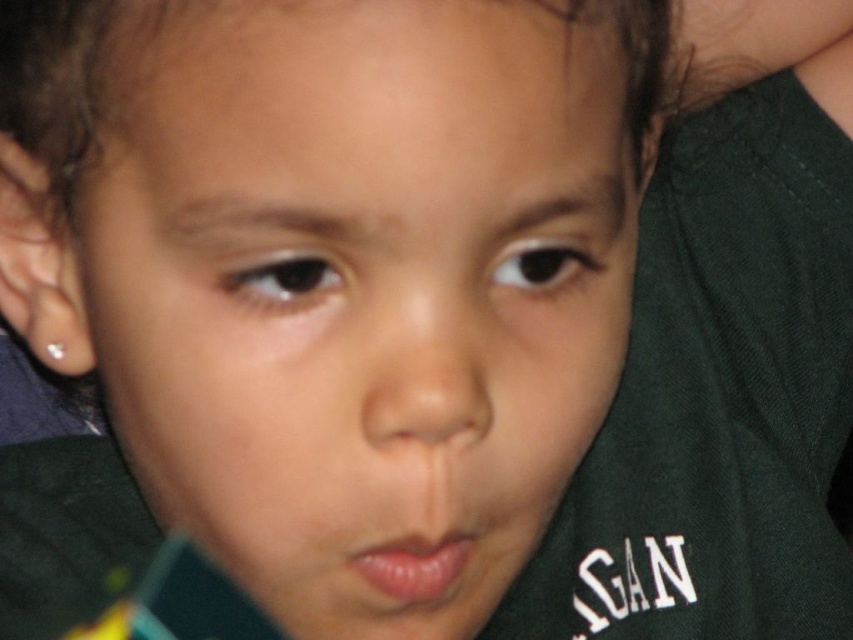
In the scene shown: Is smooth skin face at center to the left of smooth skin nose at center from the viewer's perspective?

Yes, smooth skin face at center is to the left of smooth skin nose at center.

Between smooth skin face at center and smooth skin nose at center, which one appears on the left side from the viewer's perspective?

smooth skin face at center

Which is behind, point (460, 376) or point (410, 435)?

Point (410, 435)

You are a GUI agent. You are given a task and a screenshot of the screen. Output one action in this format:
    pyautogui.click(x=<x>, y=<y>)
    Task: Click on the smooth skin face at center
    The height and width of the screenshot is (640, 853).
    Given the screenshot: What is the action you would take?
    pyautogui.click(x=358, y=285)

Who is positioned more to the right, smooth skin nose at center or pink smooth lips at center?

smooth skin nose at center

Who is more distant from viewer, (x=451, y=340) or (x=375, y=572)?

The point (x=375, y=572) is behind.

The image size is (853, 640). What do you see at coordinates (428, 384) in the screenshot?
I see `smooth skin nose at center` at bounding box center [428, 384].

Image resolution: width=853 pixels, height=640 pixels. Identify the location of smooth skin nose at center. (428, 384).

Between point (357, 116) and point (381, 586), which one is positioned in front?

Point (357, 116)

Image resolution: width=853 pixels, height=640 pixels. What are the coordinates of `smooth skin face at center` in the screenshot? It's located at (358, 285).